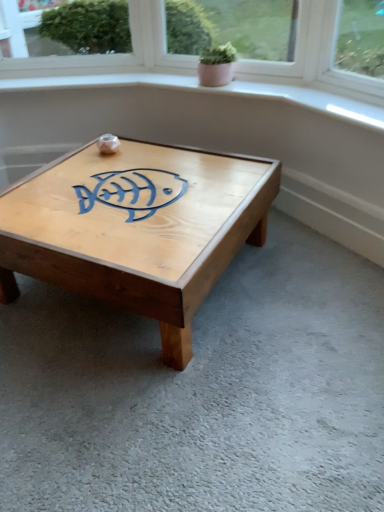
Question: Is natural wood coffee table at center wider or thinner than pink matte pot at upper center?

Choices:
 (A) thin
 (B) wide

Answer: (B)

Question: In the image, is natural wood coffee table at center positioned in front of or behind pink matte pot at upper center?

Choices:
 (A) front
 (B) behind

Answer: (A)

Question: Is natural wood coffee table at center situated inside pink matte pot at upper center or outside?

Choices:
 (A) outside
 (B) inside

Answer: (A)

Question: Considering the positions of pink matte pot at upper center and natural wood coffee table at center in the image, is pink matte pot at upper center taller or shorter than natural wood coffee table at center?

Choices:
 (A) tall
 (B) short

Answer: (B)

Question: From the image's perspective, relative to natural wood coffee table at center, is pink matte pot at upper center above or below?

Choices:
 (A) below
 (B) above

Answer: (B)

Question: In the image, is pink matte pot at upper center on the left side or the right side of natural wood coffee table at center?

Choices:
 (A) right
 (B) left

Answer: (A)

Question: Relative to natural wood coffee table at center, is pink matte pot at upper center in front or behind?

Choices:
 (A) behind
 (B) front

Answer: (A)